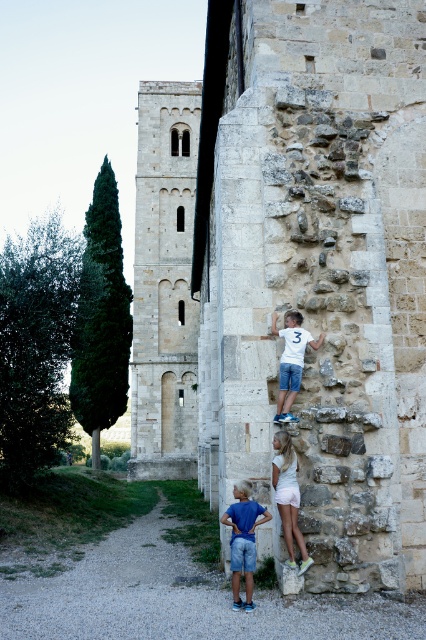
Question: Does stone textured wall at right appear on the right side of blue denim shorts at lower center?

Choices:
 (A) yes
 (B) no

Answer: (A)

Question: Which point is farther to the camera?

Choices:
 (A) (161, 342)
 (B) (270, 250)
 (C) (233, 538)
 (D) (302, 540)

Answer: (A)

Question: Considering the real-world distances, which object is farthest from the white cotton shirt at center?

Choices:
 (A) blue denim shorts at lower center
 (B) stone textured tower at center
 (C) white cotton shorts at center
 (D) stone textured wall at right

Answer: (B)

Question: Which of the following is the farthest from the observer?

Choices:
 (A) (290, 353)
 (B) (239, 570)

Answer: (A)

Question: Can you confirm if stone textured wall at right is thinner than stone textured tower at center?

Choices:
 (A) no
 (B) yes

Answer: (A)

Question: From the image, what is the correct spatial relationship of blue denim shorts at lower center in relation to white cotton shorts at center?

Choices:
 (A) left
 (B) right

Answer: (A)